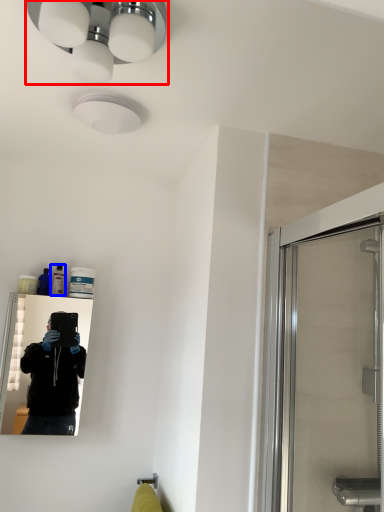
Question: Among these objects, which one is farthest to the camera, light fixture (highlighted by a red box) or toiletry (highlighted by a blue box)?

Choices:
 (A) light fixture
 (B) toiletry

Answer: (B)